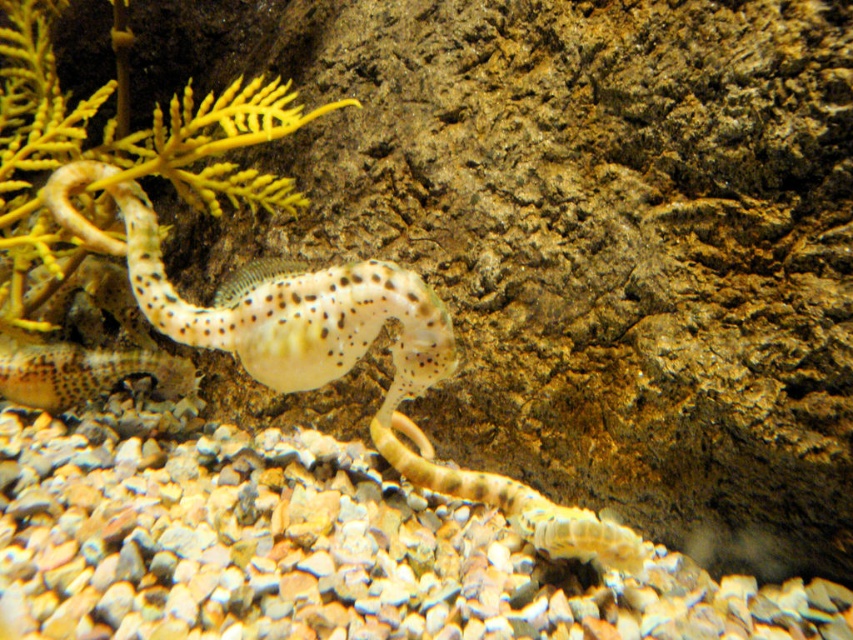
Question: Among these points, which one is farthest from the camera?

Choices:
 (A) (32, 396)
 (B) (305, 353)
 (C) (253, 278)

Answer: (A)

Question: Which of the following is the closest to the observer?

Choices:
 (A) (451, 369)
 (B) (254, 113)

Answer: (A)

Question: Which of these objects is positioned farthest from the speckled translucent seahorse at center?

Choices:
 (A) yellow leafy plant at upper left
 (B) speckled translucent gecko at center

Answer: (A)

Question: Can you confirm if speckled translucent gecko at center is positioned below yellow leafy plant at upper left?

Choices:
 (A) no
 (B) yes

Answer: (B)

Question: Is yellow leafy plant at upper left below speckled translucent seahorse at center?

Choices:
 (A) yes
 (B) no

Answer: (B)

Question: Can you confirm if yellow leafy plant at upper left is positioned to the right of speckled translucent seahorse at center?

Choices:
 (A) no
 (B) yes

Answer: (A)